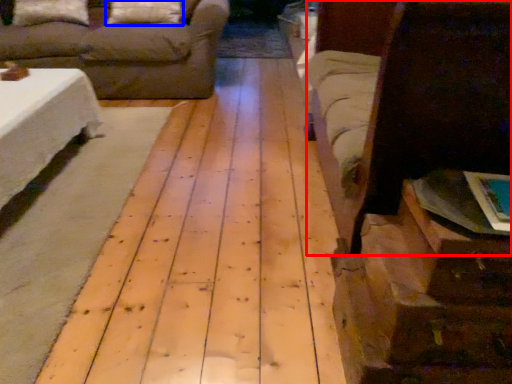
Question: Which point is further to the camera, bed (highlighted by a red box) or pillow (highlighted by a blue box)?

Choices:
 (A) bed
 (B) pillow

Answer: (B)